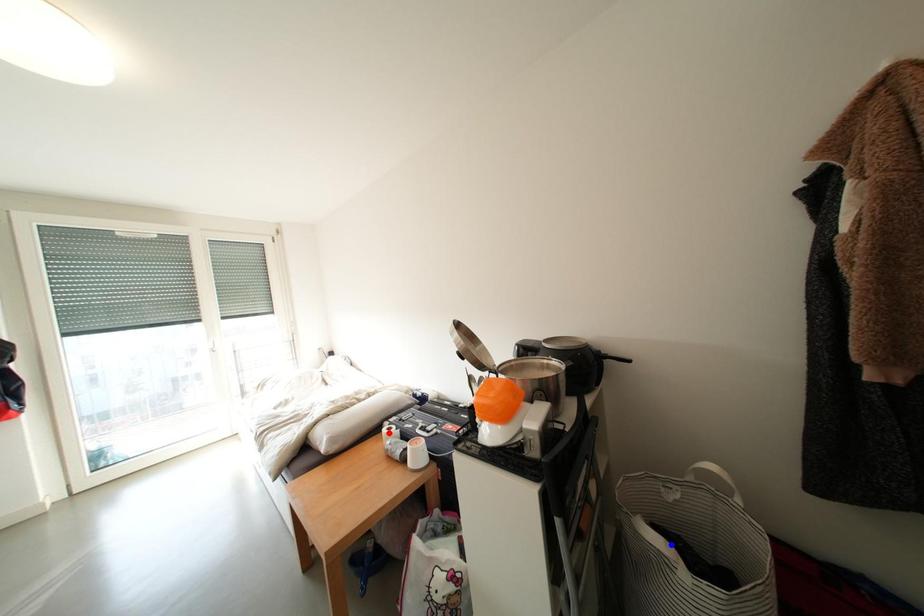
Question: Which of the two points in the image is closer to the camera?

Choices:
 (A) Blue point is closer.
 (B) Red point is closer.

Answer: (A)